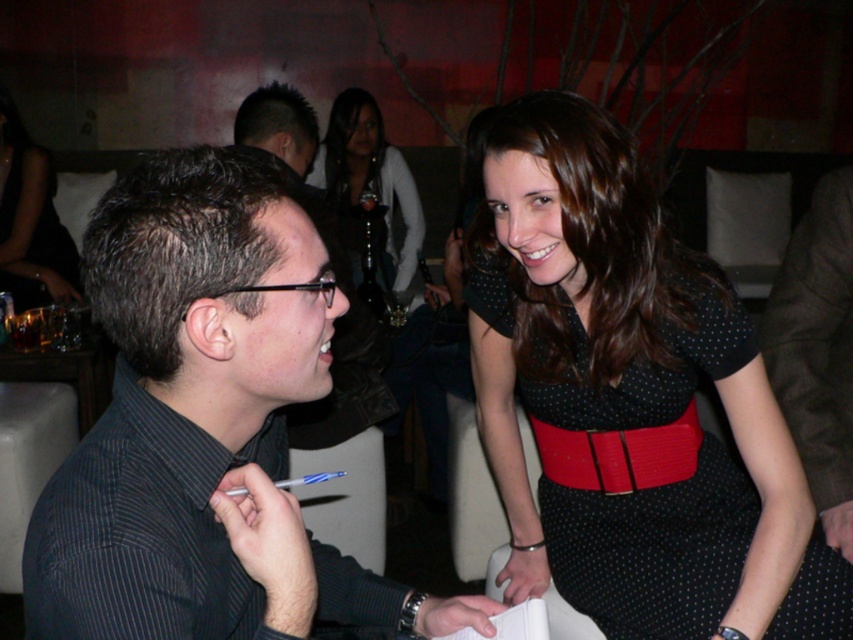
Question: Is black satin dress at center to the right of matte black dress at center from the viewer's perspective?

Choices:
 (A) no
 (B) yes

Answer: (A)

Question: Can you confirm if black dotted fabric dress at upper right is thinner than matte black dress at center?

Choices:
 (A) yes
 (B) no

Answer: (B)

Question: Which point is closer to the camera taking this photo?

Choices:
 (A) (341, 202)
 (B) (48, 260)
 (C) (129, 536)

Answer: (C)

Question: Which of the following is the closest to the observer?

Choices:
 (A) matte black dress at center
 (B) black dotted fabric dress at upper right
 (C) black satin dress at center
 (D) dark gray striped shirt at left

Answer: (D)

Question: Which of the following is the closest to the observer?

Choices:
 (A) (4, 225)
 (B) (241, 337)
 (C) (416, 262)
 (D) (595, 570)

Answer: (B)

Question: Does black dotted fabric dress at upper right appear on the right side of matte black dress at center?

Choices:
 (A) no
 (B) yes

Answer: (B)